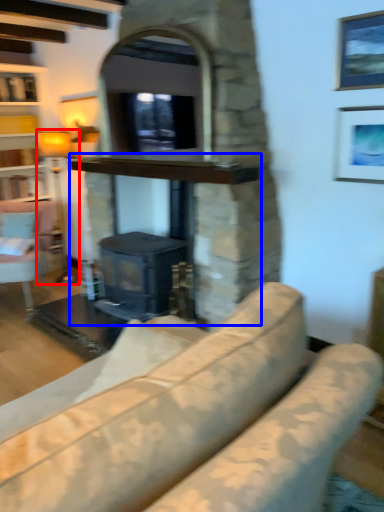
Question: Which object appears closest to the camera in this image, lamp (highlighted by a red box) or fireplace (highlighted by a blue box)?

Choices:
 (A) lamp
 (B) fireplace

Answer: (B)